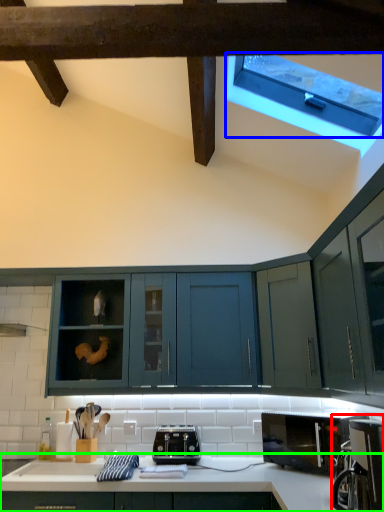
Question: Which is nearer to the coffee machine (highlighted by a red box)? window (highlighted by a blue box) or countertop (highlighted by a green box).

Choices:
 (A) window
 (B) countertop

Answer: (B)